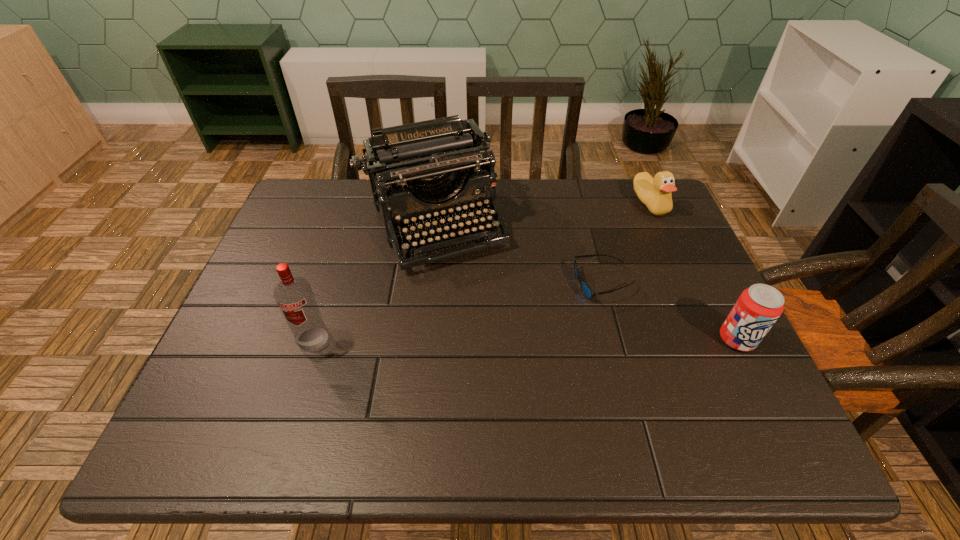
The image size is (960, 540). I want to click on unoccupied position between the typewriter and the shortest object, so click(x=519, y=255).

Find the location of a particular element. The image size is (960, 540). unoccupied position between the typewriter and the third object from left to right is located at coordinates (519, 255).

Where is `blank region between the fourth tallest object and the sunglasses`? blank region between the fourth tallest object and the sunglasses is located at coordinates (627, 244).

Locate an element on the screen. The width and height of the screenshot is (960, 540). free space between the soda can and the vodka is located at coordinates (525, 339).

The image size is (960, 540). I want to click on free area in between the sunglasses and the duck, so pyautogui.click(x=627, y=244).

Locate which object ranks second in proximity to the second shortest object. Please provide its 2D coordinates. Your answer should be formatted as a tuple, i.e. [(x, y)], where the tuple contains the x and y coordinates of a point satisfying the conditions above.

[(422, 161)]

Identify which object is located as the nearest to the soda can. Please provide its 2D coordinates. Your answer should be formatted as a tuple, i.e. [(x, y)], where the tuple contains the x and y coordinates of a point satisfying the conditions above.

[(587, 291)]